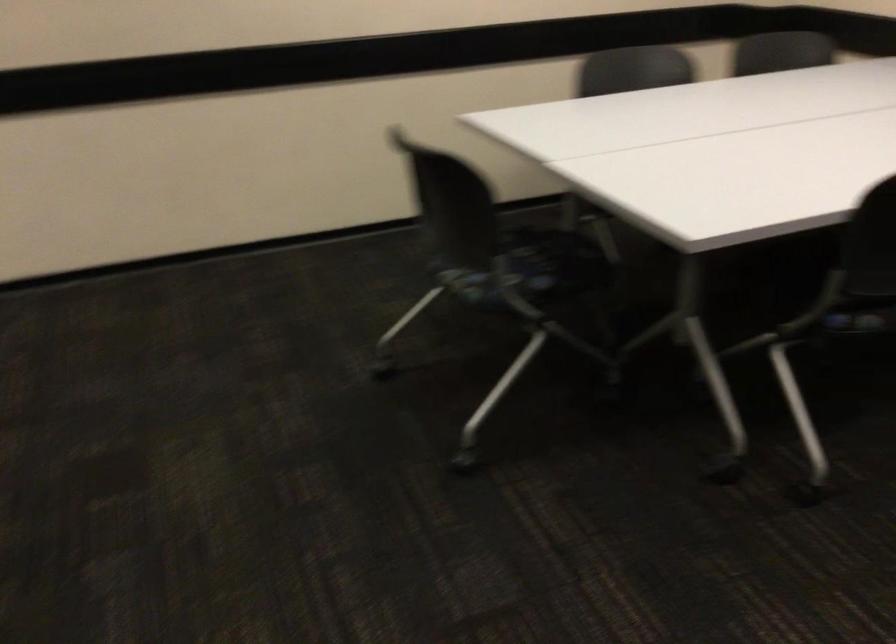
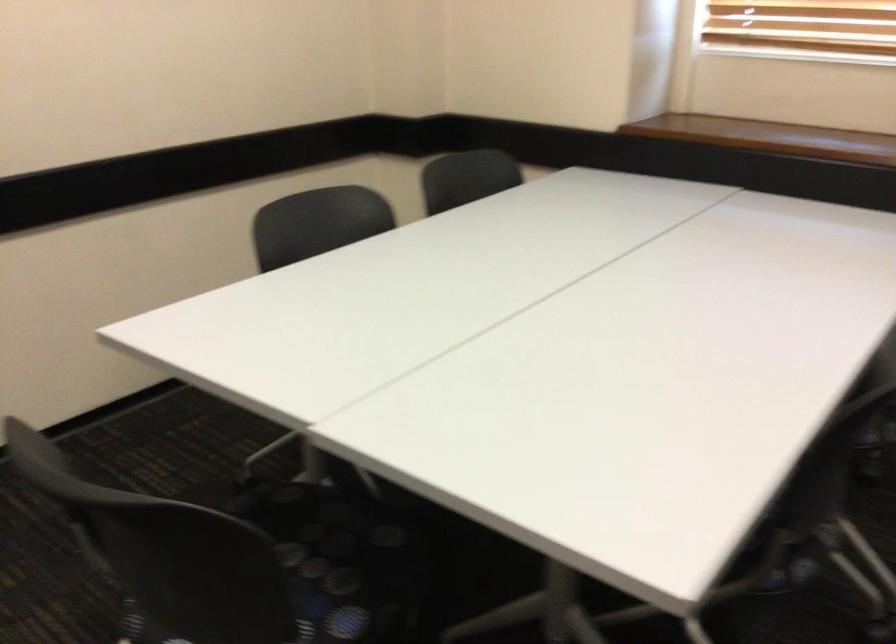
Question: The images are taken continuously from a first-person perspective. In which direction is your viewpoint rotating?

Choices:
 (A) Left
 (B) Right
 (C) Up
 (D) Down

Answer: (B)